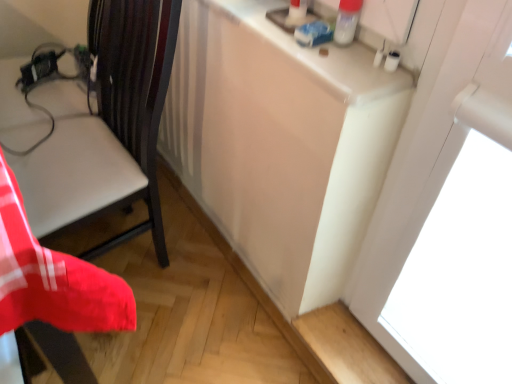
The image size is (512, 384). Identify the location of free spot to the right of matte black chair at left. (216, 291).